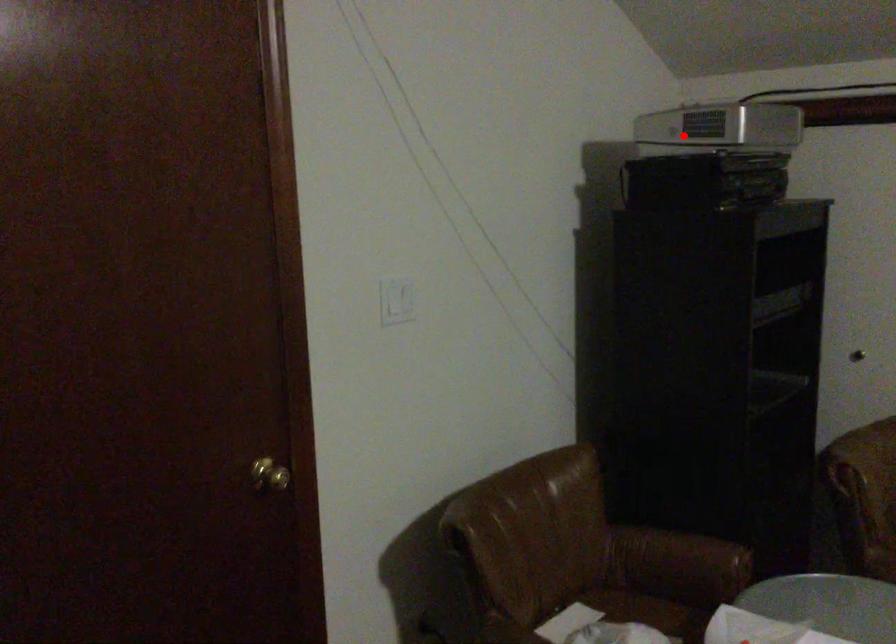
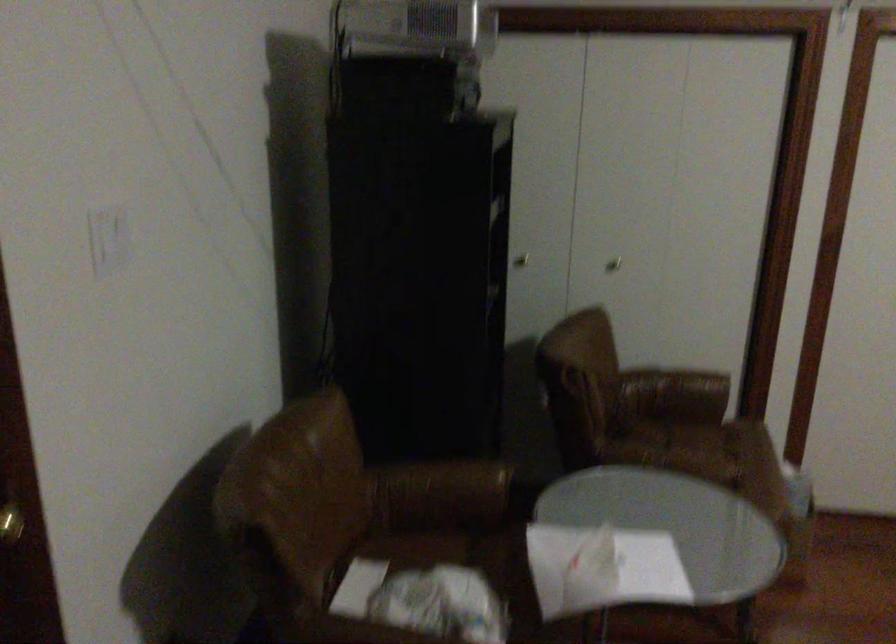
Question: A red point is marked in image1. In image2, is the corresponding 3D point closer to the camera or farther? Reply with the corresponding letter.

Choices:
 (A) The corresponding 3D point is closer.
 (B) The corresponding 3D point is farther.

Answer: (A)